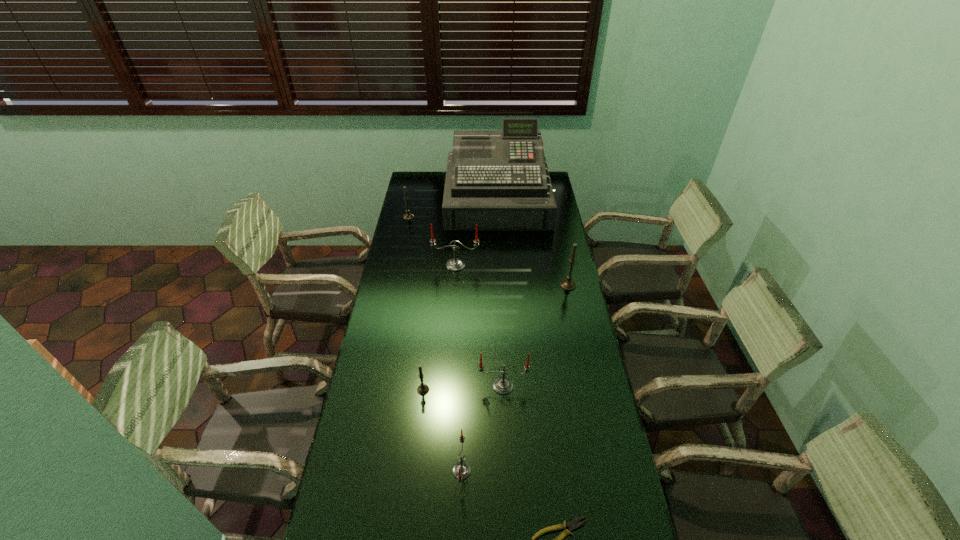
At what (x,y) coordinates should I click in order to perform the action: click on object that is positioned at the far edge. Please return your answer as a coordinate pair (x, y). This screenshot has height=540, width=960. Looking at the image, I should click on (498, 179).

Where is `object that is positioned at the left edge`? The image size is (960, 540). object that is positioned at the left edge is located at coordinates (408, 216).

I want to click on cash register at the right edge, so click(498, 179).

Identify the location of candle at the right edge. (567, 284).

The image size is (960, 540). I want to click on object that is at the far right corner, so click(498, 179).

Find the location of a particular element. This screenshot has width=960, height=540. vacant space at the left edge of the desktop is located at coordinates (413, 315).

In the image, there is a desktop. Identify the location of free space at the right edge. (614, 462).

Where is `vacant area between the second nearest red candle and the third farthest candle`? This screenshot has height=540, width=960. vacant area between the second nearest red candle and the third farthest candle is located at coordinates (536, 336).

This screenshot has width=960, height=540. I want to click on free space that is in between the nearest candle and the gray cash register, so click(479, 335).

Image resolution: width=960 pixels, height=540 pixels. In order to click on vacant region between the nearest gray candle and the second biggest red candle in this screenshot , I will do `click(463, 388)`.